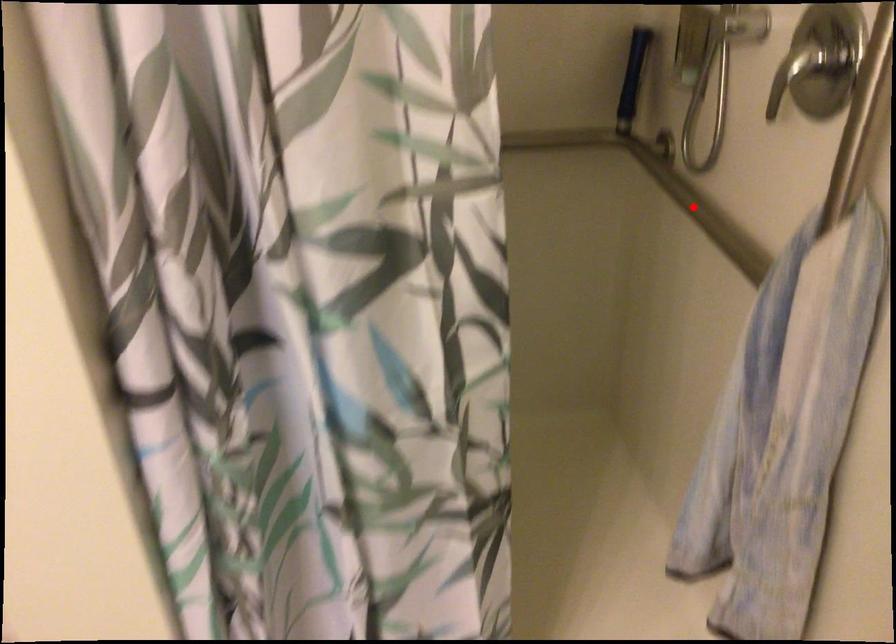
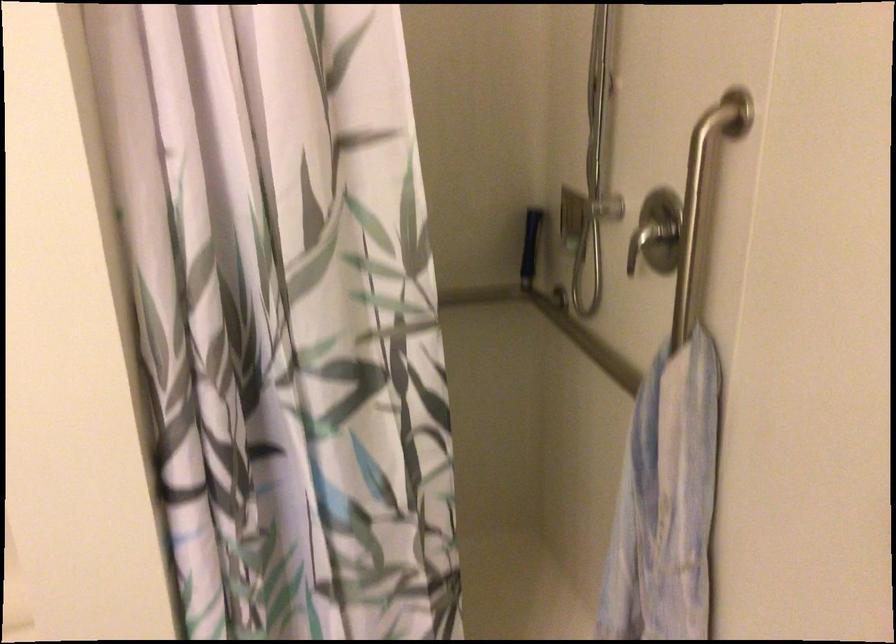
Question: I am providing you with two images of the same scene from different viewpoints. A red point is marked on the first image. Can you still see the location of the red point in image 2?

Choices:
 (A) Yes
 (B) No

Answer: (A)